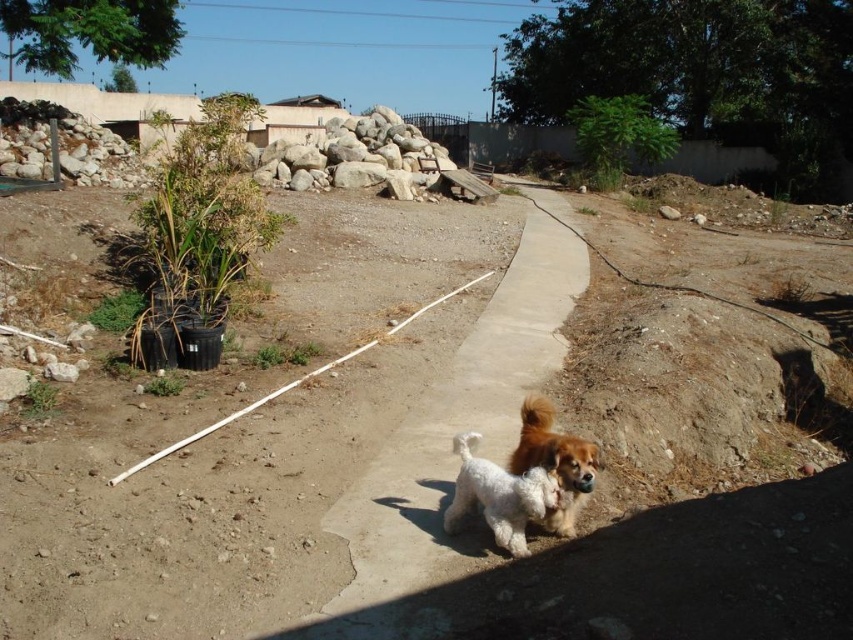
Question: Which of the following is the farthest from the observer?

Choices:
 (A) dirt track at center
 (B) white fluffy dog at center
 (C) fluffy brown and white dog at center
 (D) concrete at center

Answer: (B)

Question: Among these points, which one is nearest to the camera?

Choices:
 (A) (576, 464)
 (B) (242, 502)
 (C) (511, 358)
 (D) (550, 477)

Answer: (A)

Question: Which of the following is the closest to the observer?

Choices:
 (A) (379, 596)
 (B) (561, 452)

Answer: (A)

Question: Can you confirm if dirt track at center is thinner than concrete at center?

Choices:
 (A) yes
 (B) no

Answer: (B)

Question: Considering the relative positions of dirt track at center and fluffy brown and white dog at center in the image provided, where is dirt track at center located with respect to fluffy brown and white dog at center?

Choices:
 (A) above
 (B) below

Answer: (A)

Question: Does concrete at center have a larger size compared to fluffy brown and white dog at center?

Choices:
 (A) no
 (B) yes

Answer: (B)